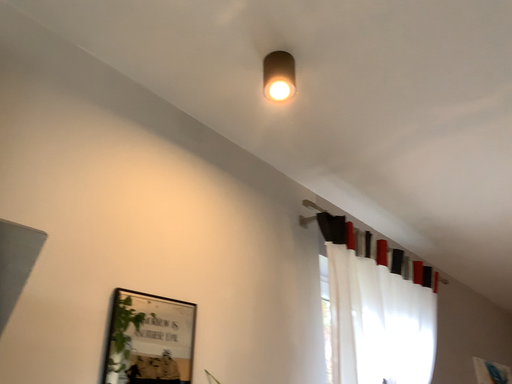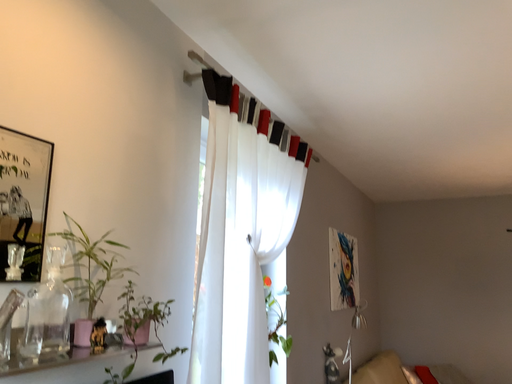
Question: How did the camera likely rotate when shooting the video?

Choices:
 (A) rotated right
 (B) rotated left

Answer: (A)